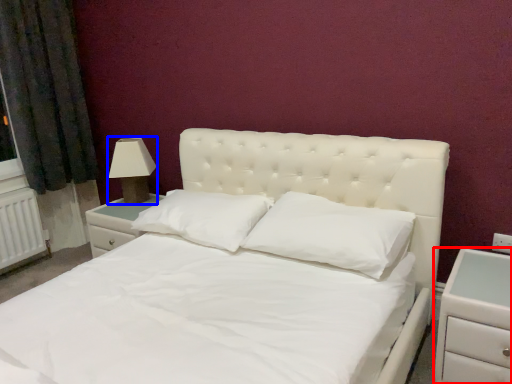
Question: Which object appears farthest to the camera in this image, nightstand (highlighted by a red box) or lamp (highlighted by a blue box)?

Choices:
 (A) nightstand
 (B) lamp

Answer: (B)